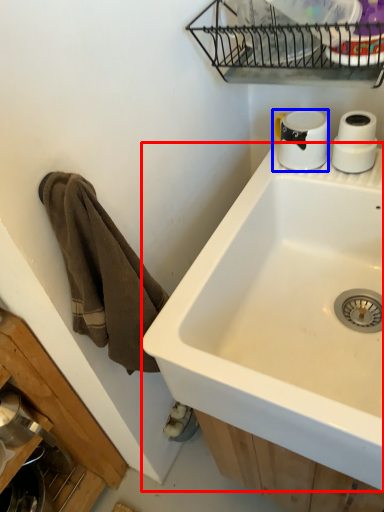
Question: Among these objects, which one is nearest to the camera, sink (highlighted by a red box) or coffee cup (highlighted by a blue box)?

Choices:
 (A) sink
 (B) coffee cup

Answer: (A)